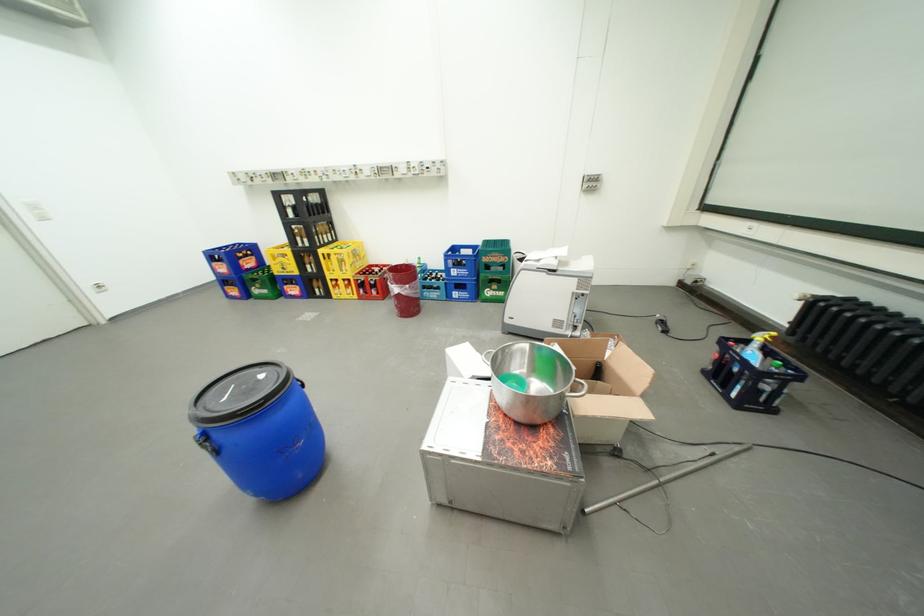
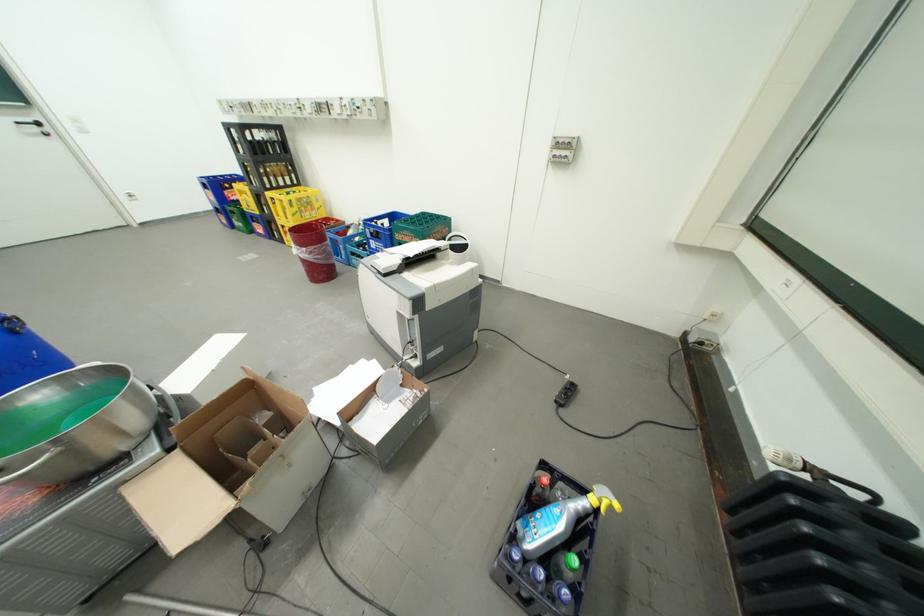
The point at [101,292] is marked in the first image. Where is the corresponding point in the second image?

(134, 199)